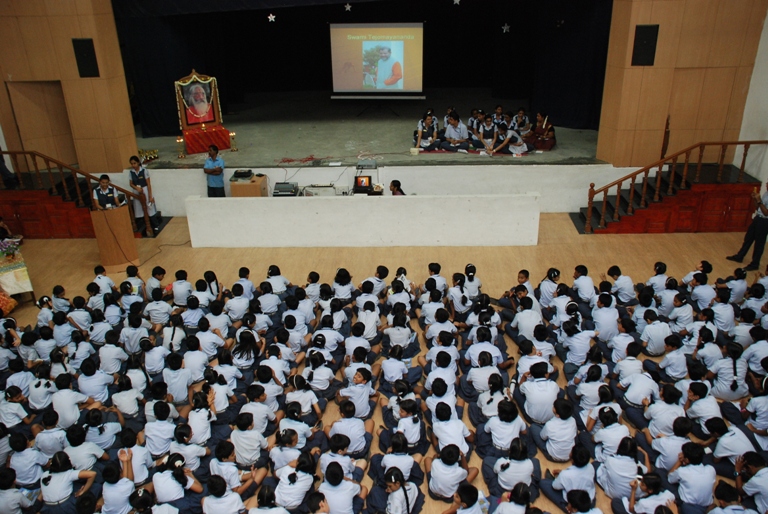
Locate an element on the screen. This screenshot has width=768, height=514. frame is located at coordinates (177, 107).